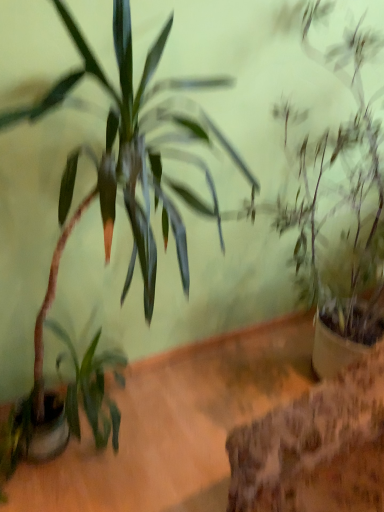
In order to click on green glossy plant at center in this screenshot , I will do `click(123, 182)`.

This screenshot has height=512, width=384. What do you see at coordinates (123, 182) in the screenshot? I see `green glossy plant at center` at bounding box center [123, 182].

Image resolution: width=384 pixels, height=512 pixels. I want to click on green glossy plant at center, so click(123, 182).